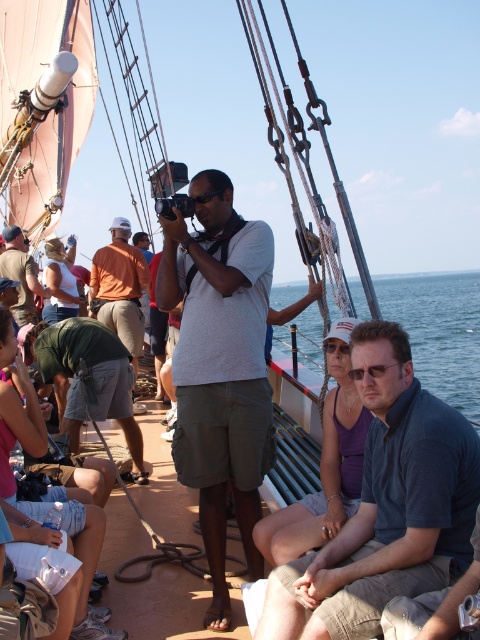
Can you confirm if dark gray shirt at center is positioned above green cotton shorts at lower left?

Incorrect, dark gray shirt at center is not positioned above green cotton shorts at lower left.

Does dark gray shirt at center have a lesser height compared to green cotton shorts at lower left?

No.

Does point (408, 529) lie behind point (122, 401)?

No, (408, 529) is in front of (122, 401).

Image resolution: width=480 pixels, height=640 pixels. What are the coordinates of `dark gray shirt at center` in the screenshot? It's located at (385, 506).

Is matte gray shirt at center to the right of blue water at lower right from the viewer's perspective?

In fact, matte gray shirt at center is to the left of blue water at lower right.

What do you see at coordinates (219, 368) in the screenshot? I see `matte gray shirt at center` at bounding box center [219, 368].

Image resolution: width=480 pixels, height=640 pixels. Identify the location of matte gray shirt at center. (219, 368).

Which is more to the right, dark gray shirt at center or matte gray shirt at center?

dark gray shirt at center is more to the right.

Does point (339, 556) come behind point (227, 179)?

No, it is in front of (227, 179).

The height and width of the screenshot is (640, 480). What do you see at coordinates (385, 506) in the screenshot?
I see `dark gray shirt at center` at bounding box center [385, 506].

The height and width of the screenshot is (640, 480). In order to click on dark gray shirt at center in this screenshot , I will do `click(385, 506)`.